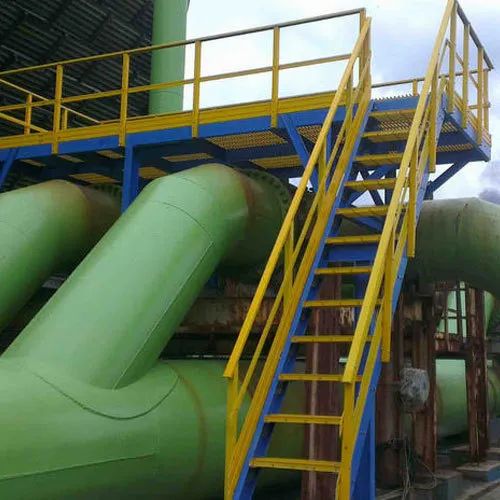
Where is `the 3rd stair`? Image resolution: width=500 pixels, height=500 pixels. the 3rd stair is located at coordinates (325, 372).